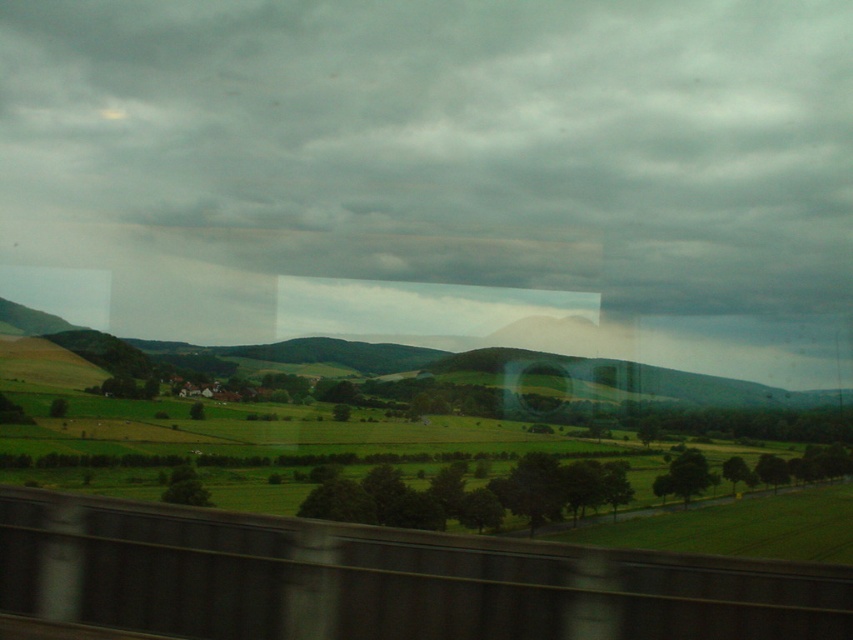
Is gray cloudy sky at upper center thinner than smooth concrete train track at bottom center?

Incorrect, gray cloudy sky at upper center's width is not less than smooth concrete train track at bottom center's.

Is gray cloudy sky at upper center wider than smooth concrete train track at bottom center?

Correct, the width of gray cloudy sky at upper center exceeds that of smooth concrete train track at bottom center.

Who is more distant from viewer, (556, 268) or (209, 582)?

Positioned behind is point (556, 268).

The height and width of the screenshot is (640, 853). Find the location of `gray cloudy sky at upper center`. gray cloudy sky at upper center is located at coordinates (433, 154).